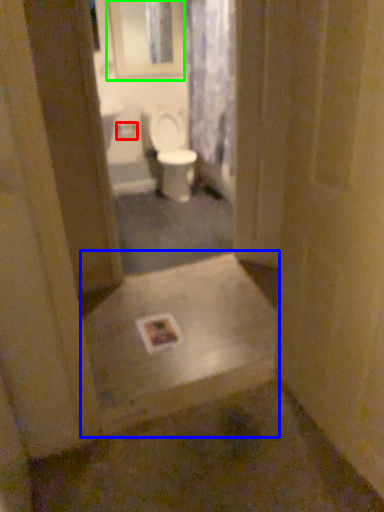
Question: Considering the real-world distances, which object is farthest from toilet paper (highlighted by a red box)? landing (highlighted by a blue box) or medicine cabinet (highlighted by a green box)?

Choices:
 (A) landing
 (B) medicine cabinet

Answer: (A)